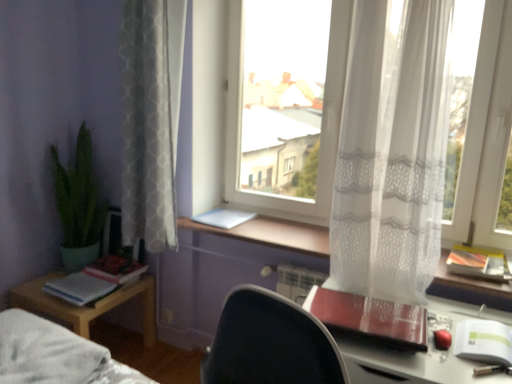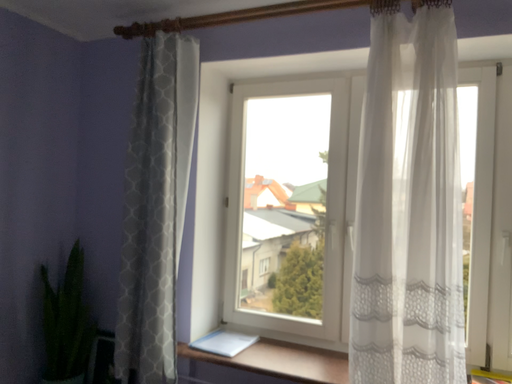
Question: Which way did the camera rotate in the video?

Choices:
 (A) rotated downward
 (B) rotated upward

Answer: (B)